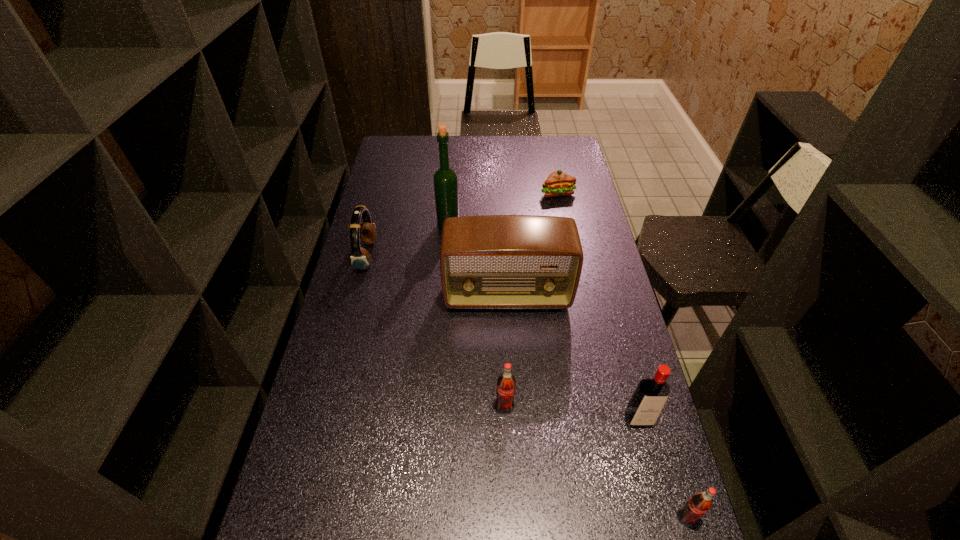
Locate an element on the screen. The width and height of the screenshot is (960, 540). the third farthest object is located at coordinates (360, 258).

The height and width of the screenshot is (540, 960). In order to click on vodka in this screenshot , I will do `click(651, 394)`.

This screenshot has height=540, width=960. What are the coordinates of `vacant space located 0.210m on the label of the farther soda bottle` in the screenshot? It's located at (509, 501).

Locate an element on the screen. Image resolution: width=960 pixels, height=540 pixels. vacant point located on the front-facing side of the fourth farthest object is located at coordinates (515, 427).

The image size is (960, 540). In order to click on free location located on the left of the sixth nearest object in this screenshot , I will do `click(377, 225)`.

At what (x,y) coordinates should I click in order to perform the action: click on vacant space located 0.270m on the back of the sandwich. Please return your answer as a coordinate pair (x, y). Image resolution: width=960 pixels, height=540 pixels. Looking at the image, I should click on (549, 152).

I want to click on vacant space situated on the ear cup of the headset, so click(x=483, y=255).

At what (x,y) coordinates should I click in order to perform the action: click on vacant region located on the front and back of the third tallest object. Please return your answer as a coordinate pair (x, y). The width and height of the screenshot is (960, 540). Looking at the image, I should click on (661, 504).

Find the location of a particular element. The image size is (960, 540). object at the near edge is located at coordinates (696, 506).

Locate an element on the screen. Image resolution: width=960 pixels, height=540 pixels. object present at the left edge is located at coordinates (360, 258).